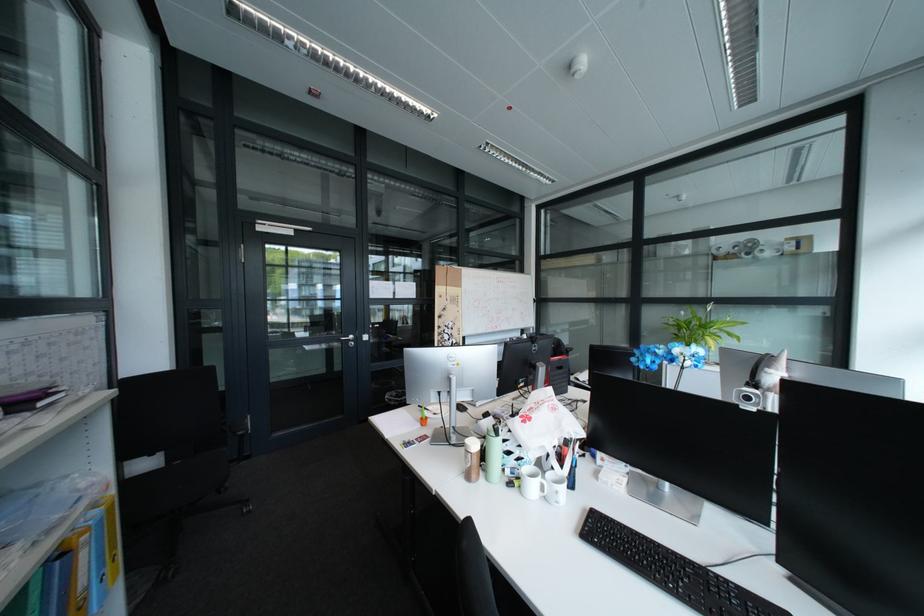
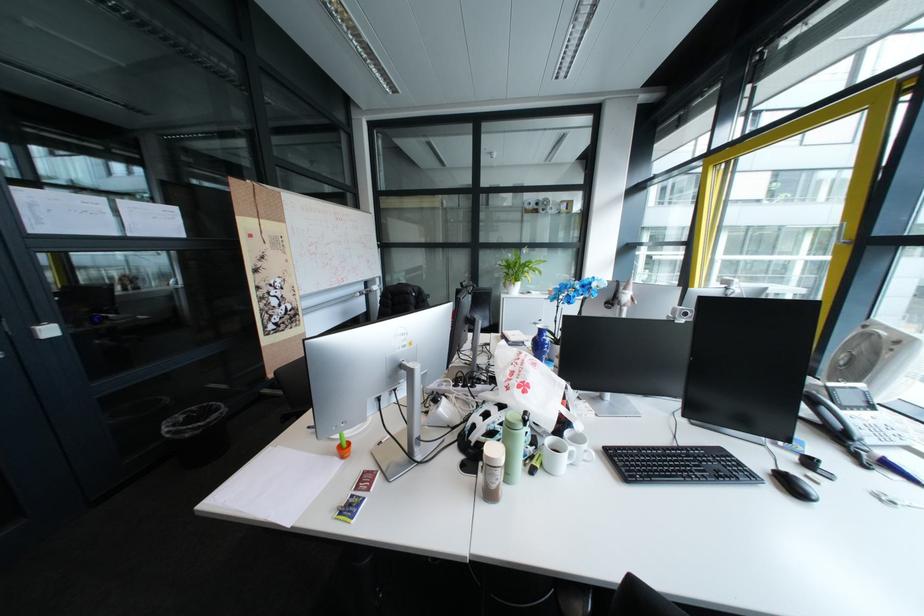
Find the pixel in the second image that matches point 562,400 in the first image.

(536, 357)